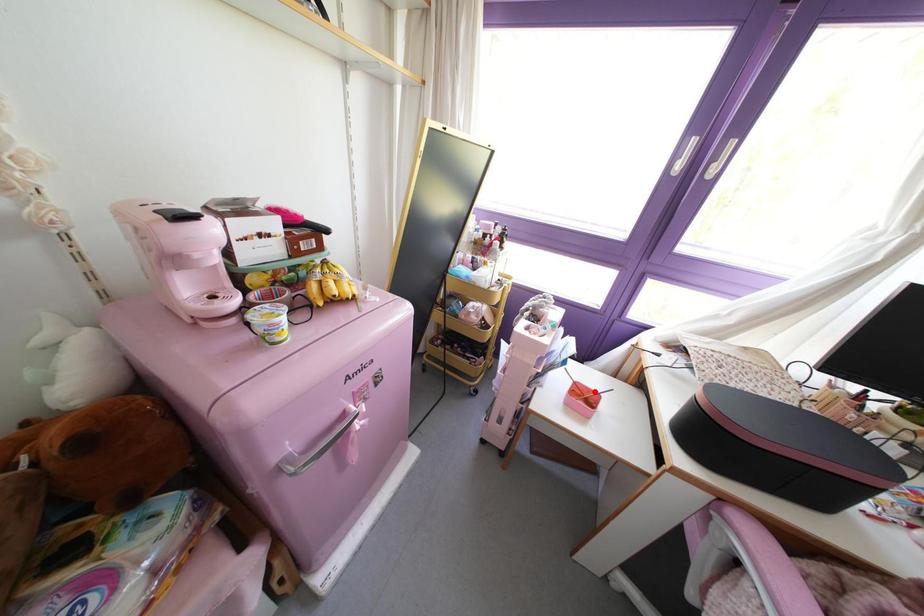
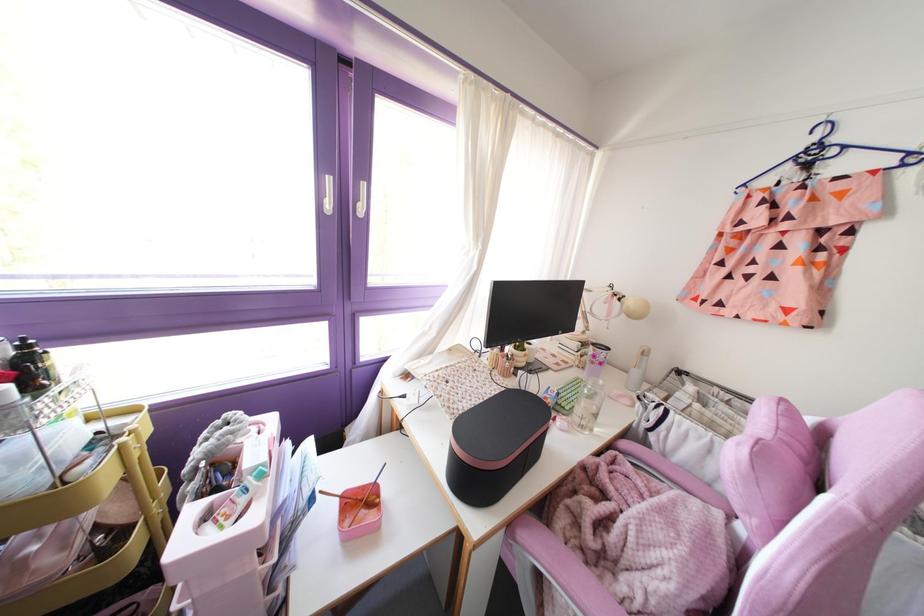
Locate, in the second image, the point that corresponds to the highlighted location in the first image.

(370, 484)